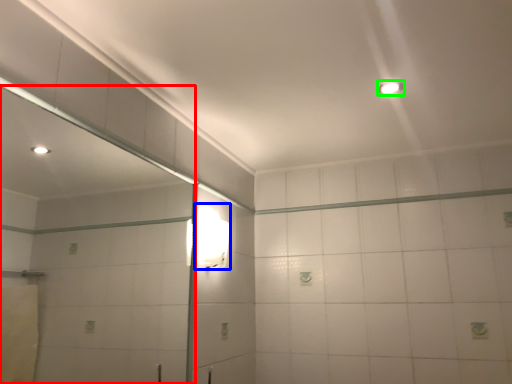
Question: Which object is positioned farthest from mirror (highlighted by a red box)? Select from light fixture (highlighted by a blue box) and light fixture (highlighted by a green box).

Choices:
 (A) light fixture
 (B) light fixture

Answer: (B)